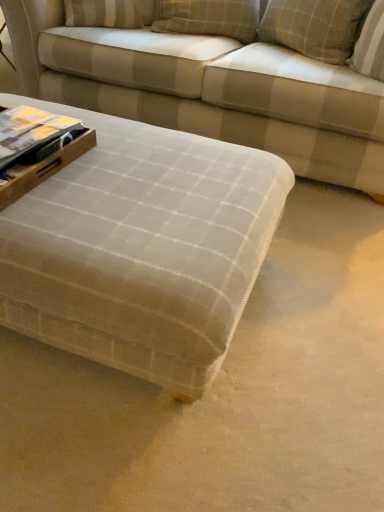
Question: Is textured beige fabric couch at center inside or outside of plaid fabric pillow at upper right, which ranks as the first pillow in right-to-left order?

Choices:
 (A) outside
 (B) inside

Answer: (A)

Question: Considering their positions, is textured beige fabric couch at center located in front of or behind plaid fabric pillow at upper right, positioned as the second pillow in left-to-right order?

Choices:
 (A) behind
 (B) front

Answer: (B)

Question: Estimate the real-world distances between objects in this image. Which object is closer to the matte paper book at left?

Choices:
 (A) textured beige ottoman at center
 (B) textured beige fabric couch at center
 (C) plaid fabric pillow at upper right, which ranks as the first pillow in right-to-left order
 (D) plaid fabric pillow at upper center, the first pillow when ordered from left to right

Answer: (A)

Question: Which object is positioned closest to the plaid fabric pillow at upper right, positioned as the second pillow in left-to-right order?

Choices:
 (A) plaid fabric pillow at upper center, which ranks as the second pillow in right-to-left order
 (B) matte paper book at left
 (C) textured beige fabric couch at center
 (D) textured beige ottoman at center

Answer: (A)